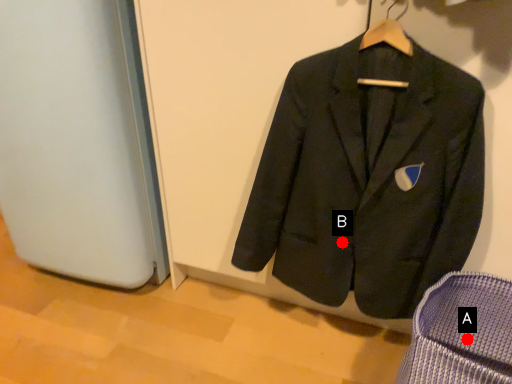
Question: Two points are circled on the image, labeled by A and B beside each circle. Which point is closer to the camera taking this photo?

Choices:
 (A) A is closer
 (B) B is closer

Answer: (B)